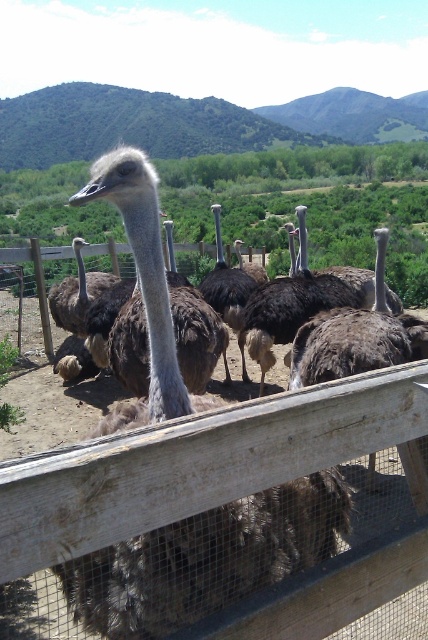
You are a zookeeper standing at the edge of the enclosure. You need to toss a treat to an ostrich but must ensure the wooden fence at center is not within your throwing range. What is the minimum distance you should aim your throw to avoid hitting the fence?

The wooden fence at center is 38.36 inches away from you. To avoid hitting the fence, you should aim your throw to be at least 38.36 inches beyond the wooden fence at center.

You are a zookeeper who wants to ensure the wooden fence at center is visible to visitors. Since the dark brown feathers at center are blocking part of it, which object should you move to improve visibility?

The dark brown feathers at center are blocking the wooden fence at center. To improve visibility, the zookeeper should move the dark brown feathers at center out of the way so the wooden fence at center becomes visible.